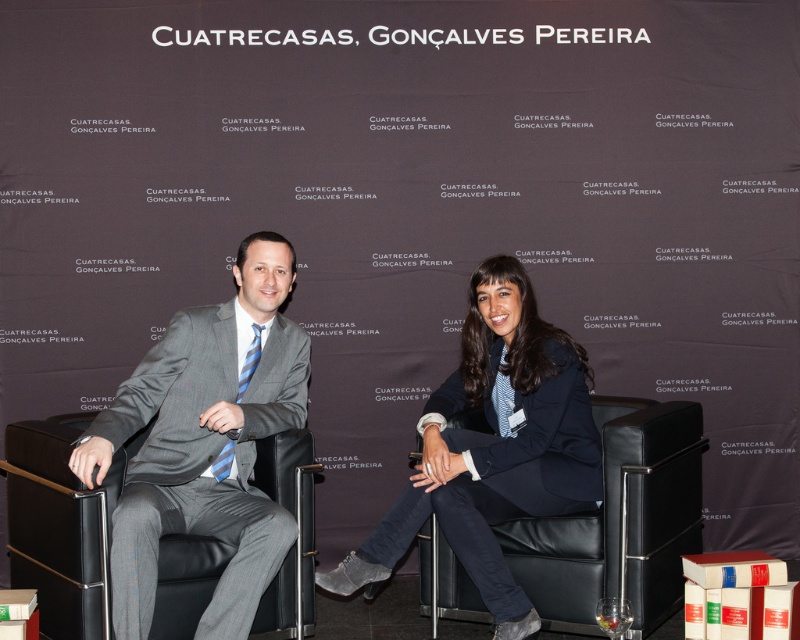
Is point (572, 490) more distant than point (192, 502)?

Yes, point (572, 490) is behind point (192, 502).

What do you see at coordinates (494, 445) in the screenshot? I see `gray suit at center` at bounding box center [494, 445].

Which is behind, point (516, 388) or point (190, 308)?

Positioned behind is point (516, 388).

Identify the location of gray suit at center. (494, 445).

Is navy blue blazer at center taller than black leather armchair at center?

Yes.

Is navy blue blazer at center to the right of black leather armchair at center from the viewer's perspective?

No, navy blue blazer at center is not to the right of black leather armchair at center.

Image resolution: width=800 pixels, height=640 pixels. What do you see at coordinates (494, 448) in the screenshot? I see `navy blue blazer at center` at bounding box center [494, 448].

Find the location of a particular element. The image size is (800, 640). navy blue blazer at center is located at coordinates (494, 448).

Between point (504, 326) and point (572, 605), which one is positioned behind?

The point (504, 326) is behind.

Locate an element on the screen. Image resolution: width=800 pixels, height=640 pixels. gray suit at center is located at coordinates (494, 445).

Image resolution: width=800 pixels, height=640 pixels. What are the coordinates of `gray suit at center` in the screenshot? It's located at (494, 445).